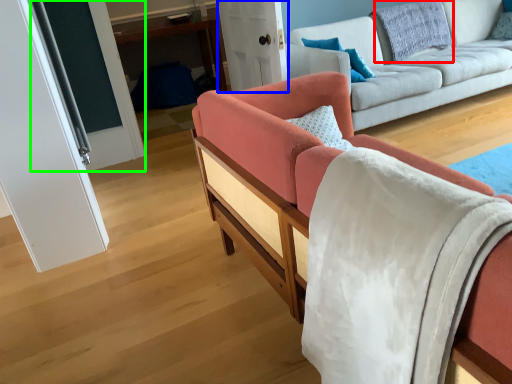
Question: Estimate the real-world distances between objects in this image. Which object is closer to pillow (highlighted by a red box), glass door (highlighted by a blue box) or glass door (highlighted by a green box)?

Choices:
 (A) glass door
 (B) glass door

Answer: (A)